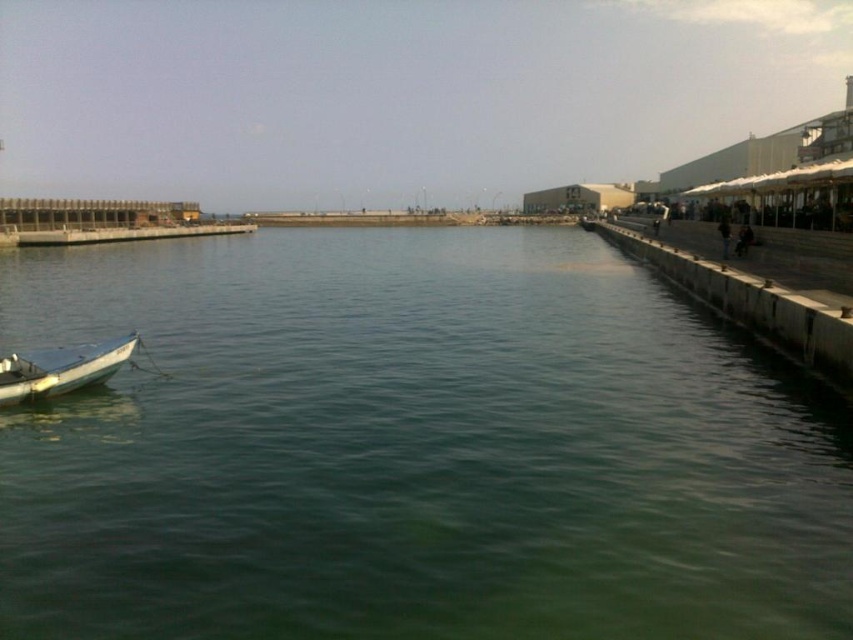
Between point (456, 259) and point (0, 356), which one is positioned in front?

Point (0, 356) is in front.

Who is shorter, green water at center or white matte boat at left?

With less height is white matte boat at left.

Between point (572, 557) and point (30, 356), which one is positioned in front?

Point (572, 557) is in front.

The image size is (853, 640). In order to click on green water at center in this screenshot , I will do `click(410, 449)`.

Is point (289, 586) farther from viewer compared to point (625, 232)?

No, it is not.

In the scene shown: Does green water at center come behind concrete at right?

No, it is in front of concrete at right.

Between point (390, 518) and point (616, 237), which one is positioned behind?

The point (616, 237) is more distant.

Where is `green water at center`? This screenshot has height=640, width=853. green water at center is located at coordinates (410, 449).

Who is shorter, concrete at right or white matte boat at left?

white matte boat at left

Is point (769, 291) farther from camera compared to point (1, 385)?

Yes, it is.

The width and height of the screenshot is (853, 640). In order to click on concrete at right in this screenshot , I will do `click(751, 305)`.